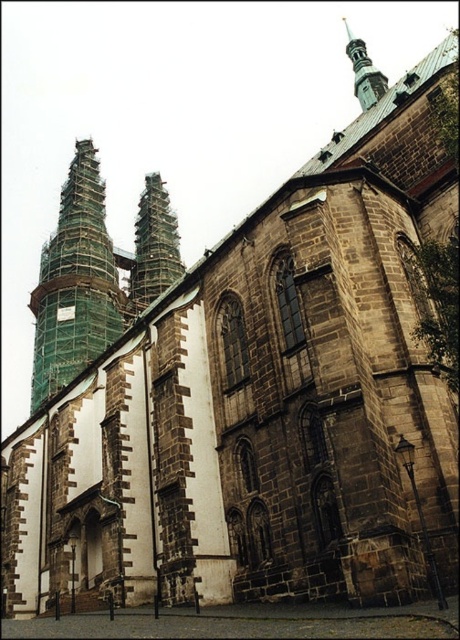
Question: Is green scaffolding tower at left smaller than green scaffolding tower at upper left?

Choices:
 (A) no
 (B) yes

Answer: (A)

Question: Estimate the real-world distances between objects in this image. Which object is closer to the green scaffolding tower at left?

Choices:
 (A) green scaffolding tower at upper left
 (B) shiny silver spire at upper center

Answer: (A)

Question: Considering the relative positions of green scaffolding tower at left and green scaffolding tower at upper left in the image provided, where is green scaffolding tower at left located with respect to green scaffolding tower at upper left?

Choices:
 (A) above
 (B) below

Answer: (B)

Question: Which object is closer to the camera taking this photo?

Choices:
 (A) green scaffolding tower at left
 (B) green scaffolding tower at upper left
 (C) shiny silver spire at upper center

Answer: (C)

Question: Can you confirm if green scaffolding tower at upper left is bigger than shiny silver spire at upper center?

Choices:
 (A) no
 (B) yes

Answer: (A)

Question: Estimate the real-world distances between objects in this image. Which object is farther from the green scaffolding tower at left?

Choices:
 (A) green scaffolding tower at upper left
 (B) shiny silver spire at upper center

Answer: (B)